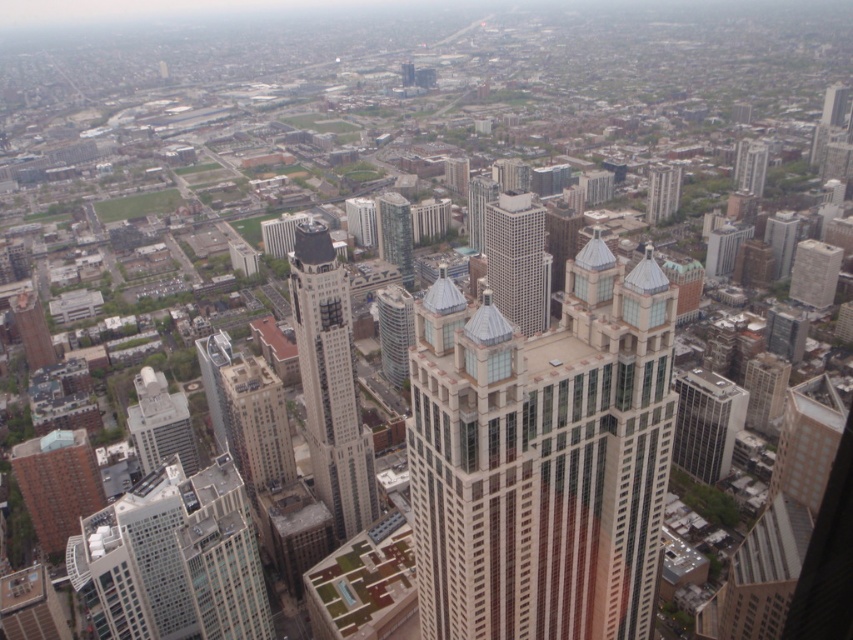
Which is above, glassy steel skyscraper at center or matte gray building at lower left?

Positioned higher is glassy steel skyscraper at center.

Who is positioned more to the right, glassy steel skyscraper at center or matte gray building at lower left?

From the viewer's perspective, glassy steel skyscraper at center appears more on the right side.

Is point (548, 257) farther from viewer compared to point (184, 406)?

No, (548, 257) is in front of (184, 406).

Find the location of `glassy steel skyscraper at center`. glassy steel skyscraper at center is located at coordinates (518, 259).

Does brown glass skyscraper at center lie in front of glassy reflective tower at center?

Yes, it is in front of glassy reflective tower at center.

Can you confirm if brown glass skyscraper at center is bigger than glassy reflective tower at center?

Yes, brown glass skyscraper at center is bigger than glassy reflective tower at center.

Is point (328, 355) positioned before point (404, 387)?

Yes, point (328, 355) is closer to viewer.

Find the location of `brown glass skyscraper at center`. brown glass skyscraper at center is located at coordinates (329, 381).

Is point (816, 284) positioned before point (676, 209)?

No, it is behind (676, 209).

Is white glass building at upper right to the right of glassy brown building at upper center from the viewer's perspective?

Yes, white glass building at upper right is to the right of glassy brown building at upper center.

Which is in front, point (839, 266) or point (666, 170)?

Point (666, 170) is more forward.

The width and height of the screenshot is (853, 640). I want to click on white glass building at upper right, so click(814, 273).